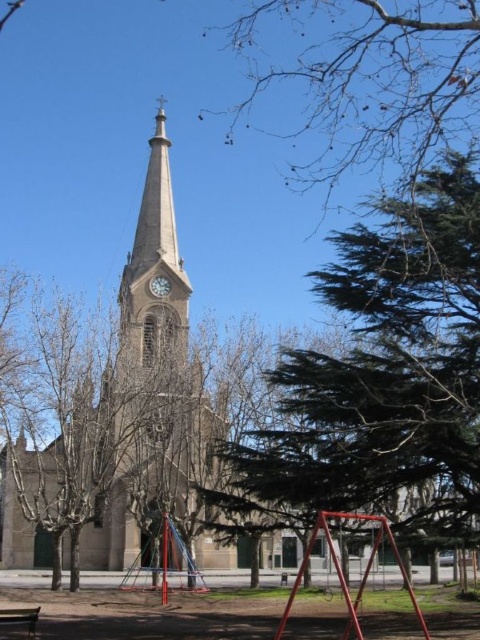
Question: Does wooden park bench at lower left appear on the left side of metallic clock at upper center?

Choices:
 (A) yes
 (B) no

Answer: (A)

Question: Does green leafy tree at upper center come behind metallic clock at upper center?

Choices:
 (A) no
 (B) yes

Answer: (A)

Question: Which point appears farthest from the camera in this image?

Choices:
 (A) (315, 116)
 (B) (327, 465)

Answer: (A)

Question: Does green needle-like leaves at center appear under metallic clock at upper center?

Choices:
 (A) yes
 (B) no

Answer: (A)

Question: Which point appears farthest from the camera in this image?

Choices:
 (A) (8, 621)
 (B) (167, 278)

Answer: (B)

Question: Which is nearer to the green needle-like leaves at center?

Choices:
 (A) green leafy tree at upper center
 (B) wooden park bench at lower left

Answer: (A)